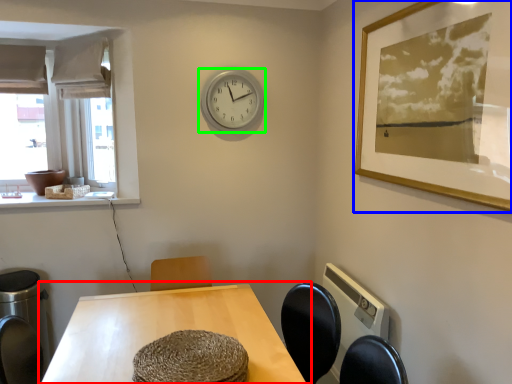
Question: Based on their relative distances, which object is nearer to table (highlighted by a red box)? Choose from picture frame (highlighted by a blue box) and wall clock (highlighted by a green box).

Choices:
 (A) picture frame
 (B) wall clock

Answer: (A)